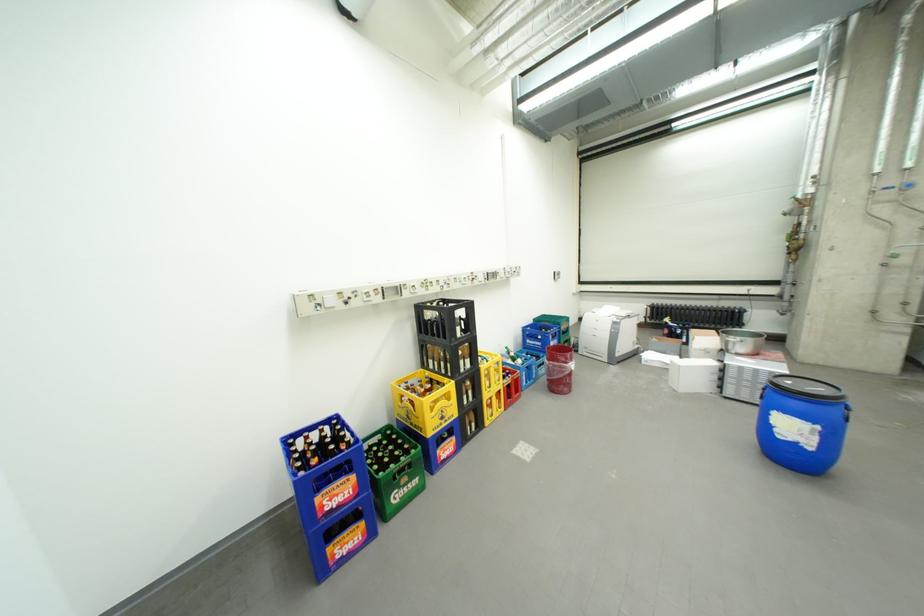
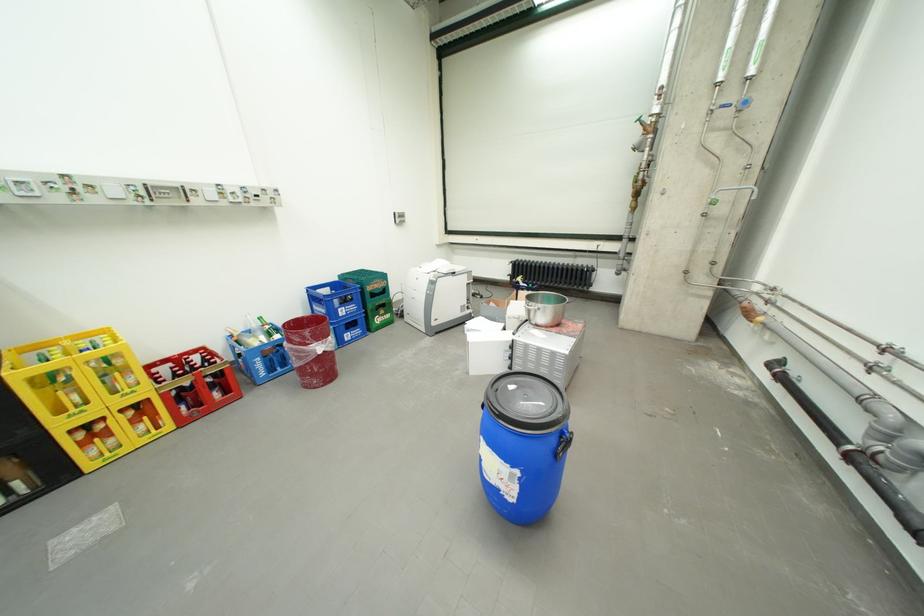
Which direction would the cameraman need to move to produce the second image?

The movement direction of the cameraman is right, forward.